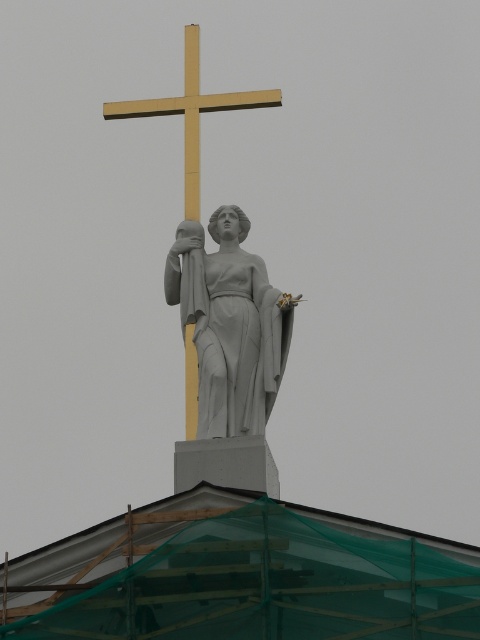
Is white marble statue at center shorter than gold polished cross at center?

Yes.

Who is positioned more to the right, white marble statue at center or gold polished cross at center?

Positioned to the right is white marble statue at center.

At what (x,y) coordinates should I click in order to perform the action: click on white marble statue at center. Please return your answer as a coordinate pair (x, y). Looking at the image, I should click on (238, 333).

The height and width of the screenshot is (640, 480). In order to click on white marble statue at center in this screenshot , I will do `click(238, 333)`.

Is point (190, 333) closer to viewer compared to point (192, 157)?

Yes, it is in front of point (192, 157).

Is gold polished cross at center positioned before gold polished wood cross at upper center?

Yes, gold polished cross at center is closer to the viewer.

Is point (230, 92) less distant than point (141, 115)?

No, it is behind (141, 115).

Find the location of `gold polished cross at center`. gold polished cross at center is located at coordinates (192, 113).

Between point (259, 300) and point (194, 113), which one is positioned in front?

Point (259, 300) is in front.

Does white marble statue at center have a lesser height compared to gold polished wood cross at upper center?

Correct, white marble statue at center is not as tall as gold polished wood cross at upper center.

Find the location of a particular element. The image size is (480, 640). white marble statue at center is located at coordinates (238, 333).

This screenshot has width=480, height=640. In order to click on white marble statue at center in this screenshot , I will do `click(238, 333)`.